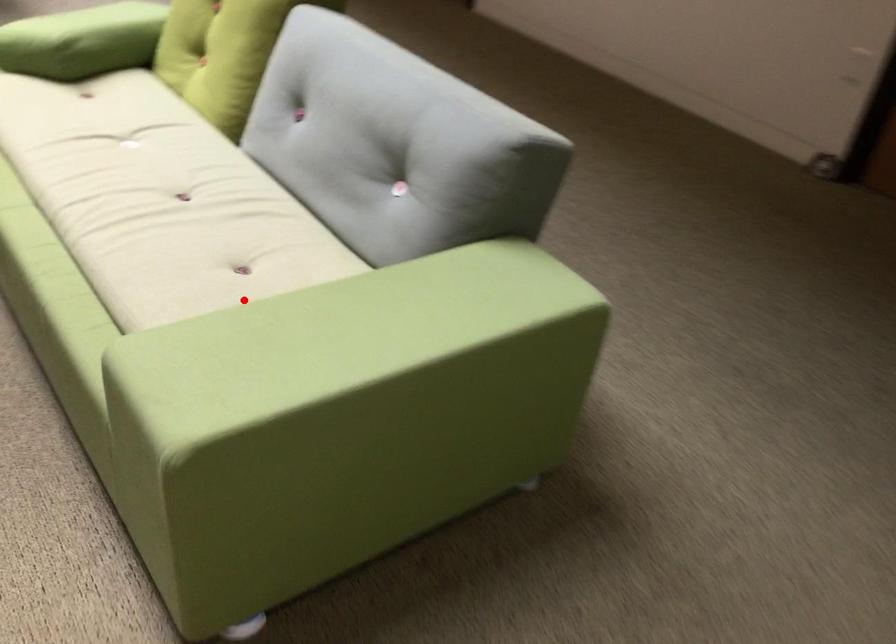
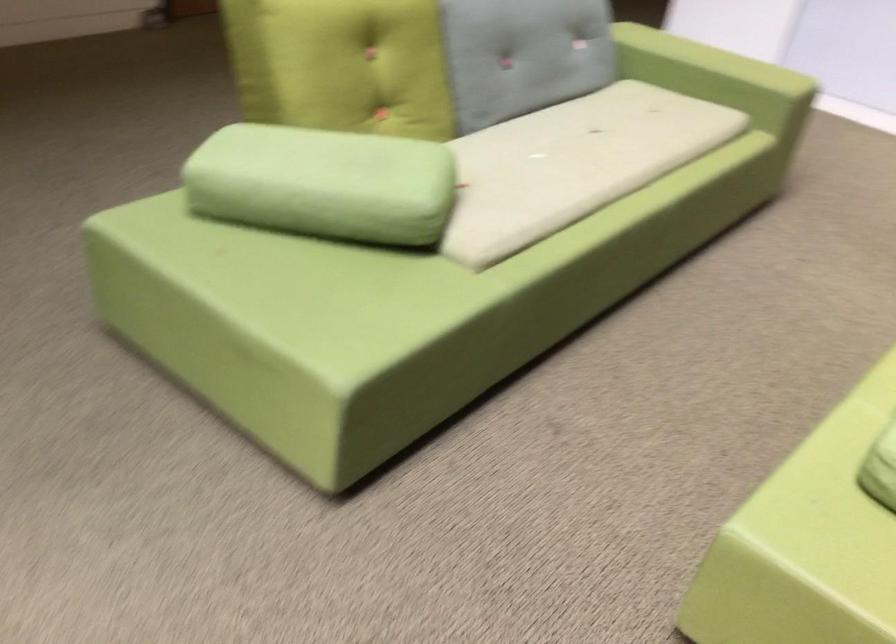
Question: I am providing you with two images of the same scene from different viewpoints. In image1, a red point is highlighted. Considering the same 3D point in image2, which of the following is correct?

Choices:
 (A) It is closer
 (B) It is farther

Answer: (B)